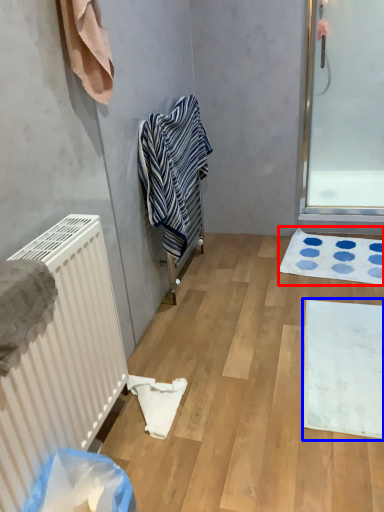
Question: Which point is further to the camera, bath mat (highlighted by a red box) or bath mat (highlighted by a blue box)?

Choices:
 (A) bath mat
 (B) bath mat

Answer: (A)